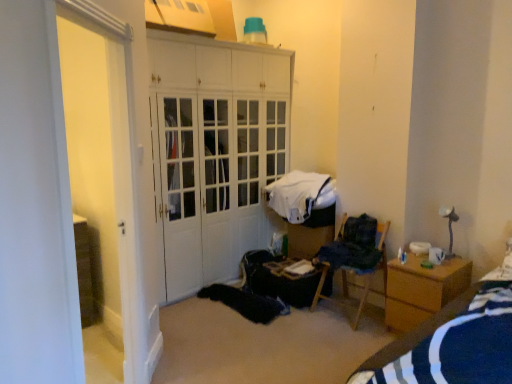
Where is `free space in front of wooden chair at center`? This screenshot has width=512, height=384. free space in front of wooden chair at center is located at coordinates (341, 336).